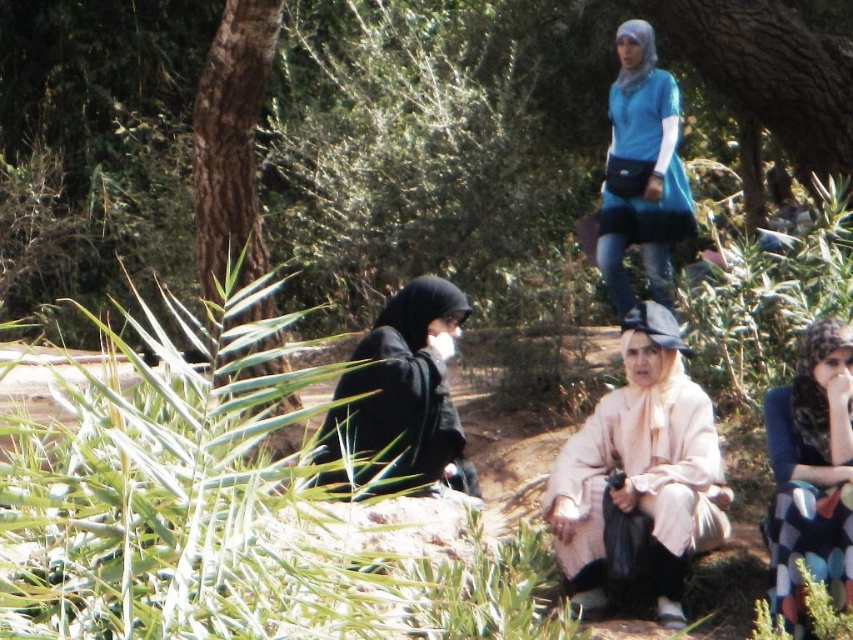
Is patterned fabric dress at lower right below black matte hijab at center?

Indeed, patterned fabric dress at lower right is positioned under black matte hijab at center.

Is point (827, 563) positioned in front of point (399, 426)?

Yes, point (827, 563) is closer to viewer.

Does point (795, 435) come closer to viewer compared to point (386, 372)?

Yes, point (795, 435) is closer to viewer.

You are a GUI agent. You are given a task and a screenshot of the screen. Output one action in this format:
    pyautogui.click(x=<x>, y=<y>)
    Task: Click on the patterned fabric dress at lower right
    
    Given the screenshot: What is the action you would take?
    pyautogui.click(x=811, y=474)

Does point (653, 548) lie in front of point (642, 106)?

That is True.

I want to click on light beige fabric coat at center, so click(641, 470).

Does point (668, 554) come behind point (650, 141)?

No, it is in front of (650, 141).

You are a GUI agent. You are given a task and a screenshot of the screen. Output one action in this format:
    pyautogui.click(x=<x>, y=<y>)
    Task: Click on the light beige fabric coat at center
    
    Given the screenshot: What is the action you would take?
    pyautogui.click(x=641, y=470)

Does patterned fabric dress at lower right have a lesser width compared to brown rough bark tree at left?

Indeed, patterned fabric dress at lower right has a lesser width compared to brown rough bark tree at left.

Image resolution: width=853 pixels, height=640 pixels. What do you see at coordinates (811, 474) in the screenshot?
I see `patterned fabric dress at lower right` at bounding box center [811, 474].

I want to click on patterned fabric dress at lower right, so click(x=811, y=474).